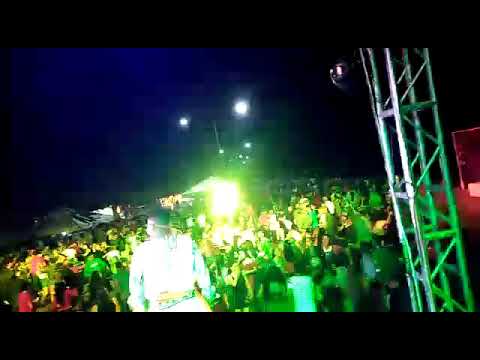
Identify the location of light. (346, 79), (219, 194), (243, 160), (247, 155), (237, 156), (245, 144), (221, 150), (182, 121), (240, 109), (108, 208).